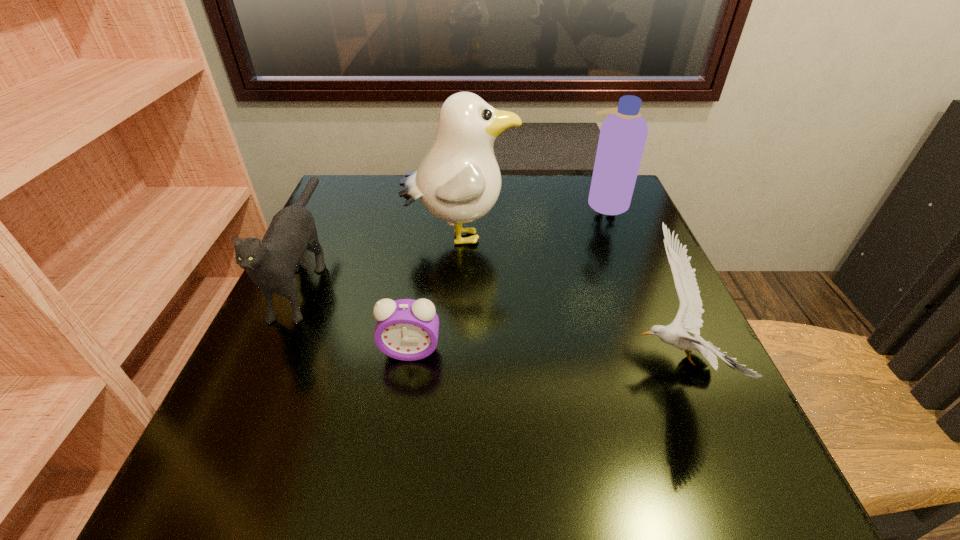
Locate an element on the screen. The width and height of the screenshot is (960, 540). gull that is positioned at the right edge is located at coordinates (688, 319).

You are a GUI agent. You are given a task and a screenshot of the screen. Output one action in this format:
    pyautogui.click(x=<x>, y=<y>)
    Task: Click on the object present at the far left corner
    This screenshot has width=960, height=540.
    Given the screenshot: What is the action you would take?
    pyautogui.click(x=271, y=264)

Where is `object that is at the far right corner`? The image size is (960, 540). object that is at the far right corner is located at coordinates (623, 134).

This screenshot has height=540, width=960. What are the coordinates of `object that is at the near right corner` in the screenshot? It's located at (688, 319).

The image size is (960, 540). What are the coordinates of `vacant space at the far edge` in the screenshot? It's located at (529, 199).

This screenshot has width=960, height=540. Identify the location of vacant space at the near edge of the desktop. (567, 459).

I want to click on free space at the left edge, so click(x=345, y=314).

Image resolution: width=960 pixels, height=540 pixels. I want to click on free space at the right edge, so click(731, 422).

You are a GUI agent. You are given a task and a screenshot of the screen. Output one action in this format:
    pyautogui.click(x=<x>, y=<y>)
    Task: Click on the free spot between the leftmost object and the farther gull
    The image size is (960, 540).
    Given the screenshot: What is the action you would take?
    pyautogui.click(x=383, y=255)

Identify the location of empty space that is in between the alarm clock and the taller gull. (435, 294).